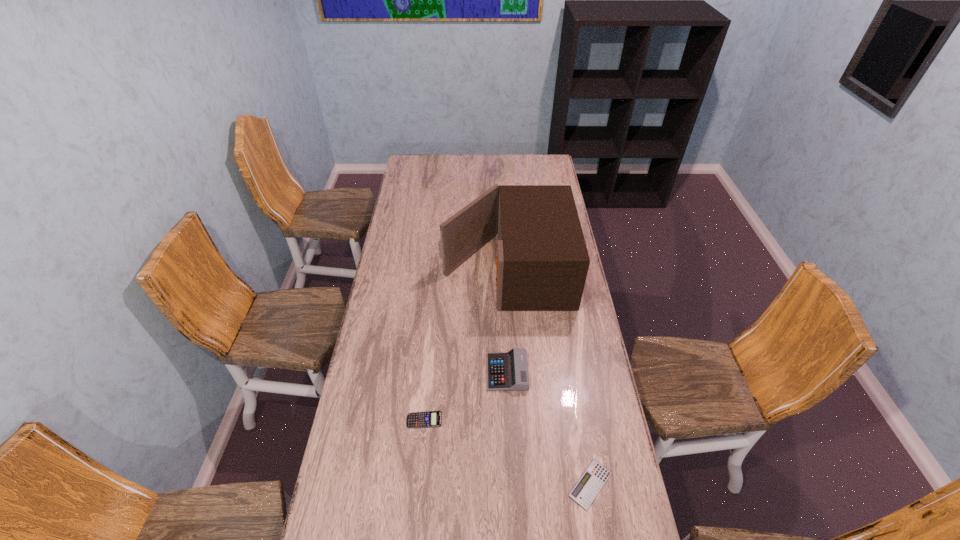
Identify the location of vacant space situated 0.080m with the door open on the front of the tallest object. The image size is (960, 540). (423, 269).

Locate an element on the screen. free space located on the right of the third nearest object is located at coordinates (566, 372).

Where is `blank area located on the right of the leftmost calculator`? blank area located on the right of the leftmost calculator is located at coordinates (521, 420).

Locate an element on the screen. Image resolution: width=960 pixels, height=540 pixels. free location located on the back of the nearest object is located at coordinates (581, 429).

Find the location of a particular element. microwave oven that is at the right edge is located at coordinates (542, 262).

This screenshot has height=540, width=960. In order to click on calculator present at the right edge in this screenshot , I will do `click(587, 488)`.

This screenshot has width=960, height=540. In order to click on free space at the left edge of the desktop in this screenshot , I will do pyautogui.click(x=372, y=325).

Find the location of a particular element. blank space at the right edge is located at coordinates (578, 326).

You are a GUI agent. You are given a task and a screenshot of the screen. Output one action in this format:
    pyautogui.click(x=<x>, y=<y>)
    Task: Click on the vacant space at the far right corner
    
    Given the screenshot: What is the action you would take?
    pyautogui.click(x=541, y=173)

The width and height of the screenshot is (960, 540). Find the location of `vacant space in between the shortest object and the farthest object`. vacant space in between the shortest object and the farthest object is located at coordinates (548, 377).